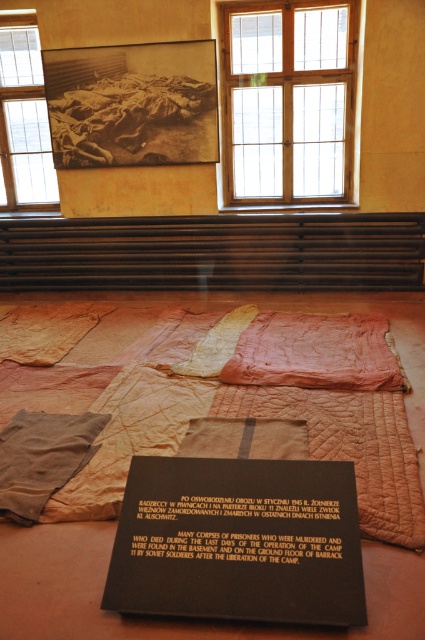
Between point (107, 589) and point (34, 186), which one is positioned in front?

Point (107, 589) is more forward.

Is black polished stone plaque at center in front of clear glass window at upper left?

Yes, it is in front of clear glass window at upper left.

Does point (257, 516) come in front of point (31, 186)?

Yes, point (257, 516) is closer to viewer.

The image size is (425, 640). What are the coordinates of `black polished stone plaque at center` in the screenshot? It's located at (238, 541).

Can you confirm if black polished stone plaque at center is positioned above wooden frame at upper center?

No, black polished stone plaque at center is not above wooden frame at upper center.

Is black polished stone plaque at center bigger than wooden frame at upper center?

Incorrect, black polished stone plaque at center is not larger than wooden frame at upper center.

Who is more forward, (286, 522) or (334, 154)?

Positioned in front is point (286, 522).

I want to click on black polished stone plaque at center, so click(238, 541).

Between wooden frame at upper center and clear glass window at upper left, which one is positioned lower?

clear glass window at upper left is below.

The image size is (425, 640). I want to click on wooden frame at upper center, so click(x=288, y=100).

Find the location of a particular element. wooden frame at upper center is located at coordinates (288, 100).